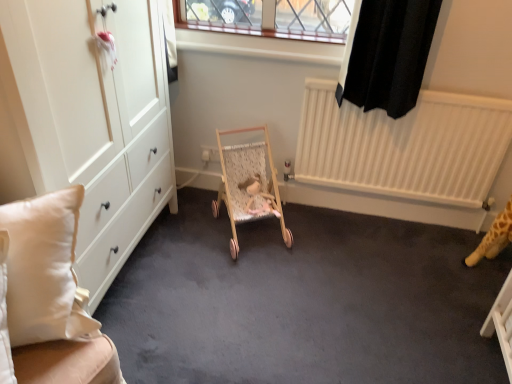
Question: From the image's perspective, is white fabric cushion at left located above wooden baby carriage at center?

Choices:
 (A) yes
 (B) no

Answer: (B)

Question: Is white fabric cushion at left to the right of wooden baby carriage at center from the viewer's perspective?

Choices:
 (A) no
 (B) yes

Answer: (A)

Question: Could you tell me if white fabric cushion at left is facing wooden baby carriage at center?

Choices:
 (A) yes
 (B) no

Answer: (B)

Question: Is white fabric cushion at left bigger than wooden baby carriage at center?

Choices:
 (A) yes
 (B) no

Answer: (A)

Question: Is white fabric cushion at left outside wooden baby carriage at center?

Choices:
 (A) yes
 (B) no

Answer: (A)

Question: Would you say white fabric cushion at left contains wooden baby carriage at center?

Choices:
 (A) yes
 (B) no

Answer: (B)

Question: Is wooden baby carriage at center to the right of white fabric cushion at left from the viewer's perspective?

Choices:
 (A) no
 (B) yes

Answer: (B)

Question: From the image's perspective, is wooden baby carriage at center located above white fabric cushion at left?

Choices:
 (A) no
 (B) yes

Answer: (B)

Question: From a real-world perspective, is wooden baby carriage at center beneath white fabric cushion at left?

Choices:
 (A) yes
 (B) no

Answer: (A)

Question: Would you consider wooden baby carriage at center to be distant from white fabric cushion at left?

Choices:
 (A) no
 (B) yes

Answer: (B)

Question: Could you tell me if wooden baby carriage at center is facing white fabric cushion at left?

Choices:
 (A) yes
 (B) no

Answer: (B)

Question: Are wooden baby carriage at center and white fabric cushion at left making contact?

Choices:
 (A) yes
 (B) no

Answer: (B)

Question: In terms of width, does white fabric cushion at left look wider or thinner when compared to wooden baby carriage at center?

Choices:
 (A) thin
 (B) wide

Answer: (A)